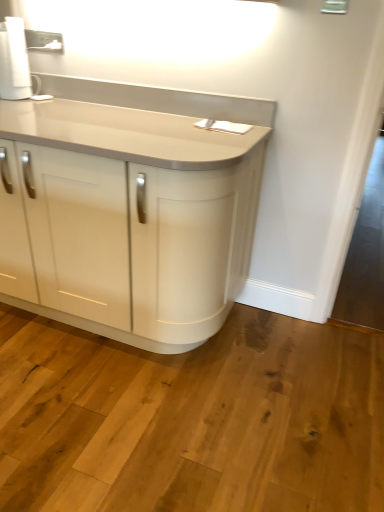
The width and height of the screenshot is (384, 512). What do you see at coordinates (14, 61) in the screenshot? I see `white matte paper towel at upper left` at bounding box center [14, 61].

At what (x,y) coordinates should I click in order to perform the action: click on white matte paper towel at upper left. Please return your answer as a coordinate pair (x, y). The image size is (384, 512). Looking at the image, I should click on (14, 61).

Measure the distance between point (3,84) and camera.

A distance of 1.89 meters exists between point (3,84) and camera.

The width and height of the screenshot is (384, 512). Describe the element at coordinates (125, 206) in the screenshot. I see `matte white cabinet at center` at that location.

I want to click on matte white cabinet at center, so click(125, 206).

Where is `white matte paper towel at upper left`? The height and width of the screenshot is (512, 384). white matte paper towel at upper left is located at coordinates (14, 61).

Based on the photo, which object is positioned more to the right, white matte paper towel at upper left or matte white cabinet at center?

From the viewer's perspective, matte white cabinet at center appears more on the right side.

Which object is closer to the camera, white matte paper towel at upper left or matte white cabinet at center?

matte white cabinet at center.

Does point (16, 49) come behind point (163, 131)?

That is True.

From the image's perspective, is white matte paper towel at upper left under matte white cabinet at center?

No, from the image's perspective, white matte paper towel at upper left is not beneath matte white cabinet at center.

From a real-world perspective, is white matte paper towel at upper left over matte white cabinet at center?

Indeed, from a real-world perspective, white matte paper towel at upper left stands above matte white cabinet at center.

Does white matte paper towel at upper left have a greater width compared to matte white cabinet at center?

No, white matte paper towel at upper left is not wider than matte white cabinet at center.

Between white matte paper towel at upper left and matte white cabinet at center, which one has less height?

Standing shorter between the two is white matte paper towel at upper left.

Who is smaller, white matte paper towel at upper left or matte white cabinet at center?

white matte paper towel at upper left.

Is white matte paper towel at upper left located outside matte white cabinet at center?

No.

Consider the image. Is white matte paper towel at upper left next to matte white cabinet at center and touching it?

No, white matte paper towel at upper left is not touching matte white cabinet at center.

Does white matte paper towel at upper left turn towards matte white cabinet at center?

No, white matte paper towel at upper left is not aimed at matte white cabinet at center.

How many degrees apart are the facing directions of white matte paper towel at upper left and matte white cabinet at center?

They differ by 0.0193 degrees in their facing directions.

Identify the location of paper towel lying on the left of matte white cabinet at center. (14, 61).

Visually, is matte white cabinet at center positioned to the left or to the right of white matte paper towel at upper left?

Clearly, matte white cabinet at center is on the right of white matte paper towel at upper left in the image.

Does matte white cabinet at center come behind white matte paper towel at upper left?

No, matte white cabinet at center is in front of white matte paper towel at upper left.

Is point (24, 112) positioned after point (7, 33)?

No, (24, 112) is in front of (7, 33).

From the image's perspective, which object appears higher, matte white cabinet at center or white matte paper towel at upper left?

white matte paper towel at upper left is shown above in the image.

From a real-world perspective, which is physically below, matte white cabinet at center or white matte paper towel at upper left?

In real-world perspective, matte white cabinet at center is lower.

Which object is thinner, matte white cabinet at center or white matte paper towel at upper left?

white matte paper towel at upper left.

Considering the relative sizes of matte white cabinet at center and white matte paper towel at upper left in the image provided, is matte white cabinet at center shorter than white matte paper towel at upper left?

No.

Does matte white cabinet at center have a larger size compared to white matte paper towel at upper left?

Yes.

Is matte white cabinet at center spatially inside white matte paper towel at upper left, or outside of it?

matte white cabinet at center is outside white matte paper towel at upper left.

Is matte white cabinet at center placed right next to white matte paper towel at upper left?

matte white cabinet at center is not next to white matte paper towel at upper left, and they're not touching.

Is matte white cabinet at center positioned with its back to white matte paper towel at upper left?

No.

Consider the image. Can you tell me how much matte white cabinet at center and white matte paper towel at upper left differ in facing direction?

0.0193 degrees.

The image size is (384, 512). I want to click on cupboard lying in front of the white matte paper towel at upper left, so click(125, 206).

Find the location of a particular element. The width and height of the screenshot is (384, 512). cupboard that is on the right side of white matte paper towel at upper left is located at coordinates (125, 206).

Where is `cupboard below the white matte paper towel at upper left (from the image's perspective)`? This screenshot has height=512, width=384. cupboard below the white matte paper towel at upper left (from the image's perspective) is located at coordinates (125, 206).